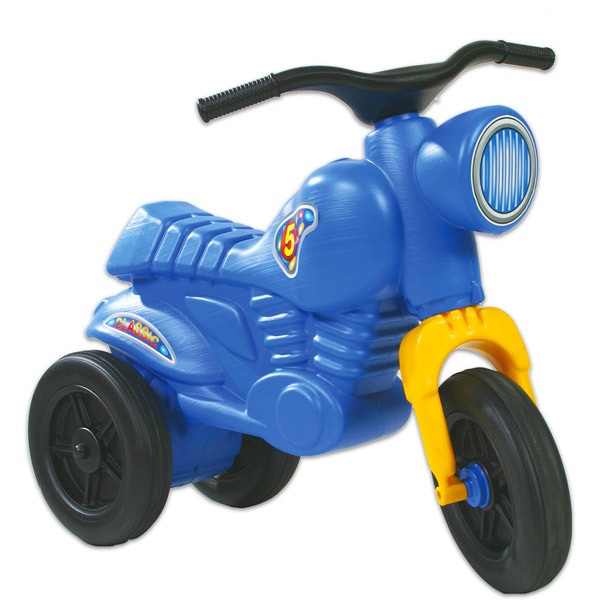
Find the location of a particular element. Image resolution: width=600 pixels, height=600 pixels. screws is located at coordinates click(x=437, y=494), click(x=78, y=447).